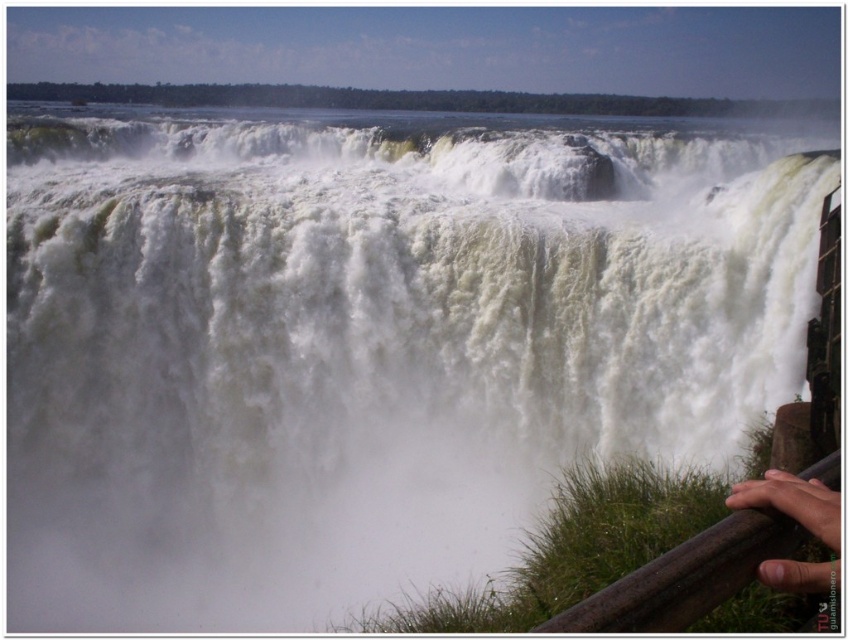
Question: Can you confirm if brown wooden rail at lower right is thinner than skinny flesh at lower right?

Choices:
 (A) no
 (B) yes

Answer: (A)

Question: Which point is farther to the camera?

Choices:
 (A) (692, 616)
 (B) (810, 516)

Answer: (B)

Question: Does brown wooden rail at lower right come in front of skinny flesh at lower right?

Choices:
 (A) no
 (B) yes

Answer: (B)

Question: Which object appears farthest from the camera in this image?

Choices:
 (A) brown wooden rail at lower right
 (B) skinny flesh at lower right

Answer: (B)

Question: Can you confirm if brown wooden rail at lower right is smaller than skinny flesh at lower right?

Choices:
 (A) yes
 (B) no

Answer: (B)

Question: Which of the following is the farthest from the observer?

Choices:
 (A) (830, 536)
 (B) (734, 556)

Answer: (B)